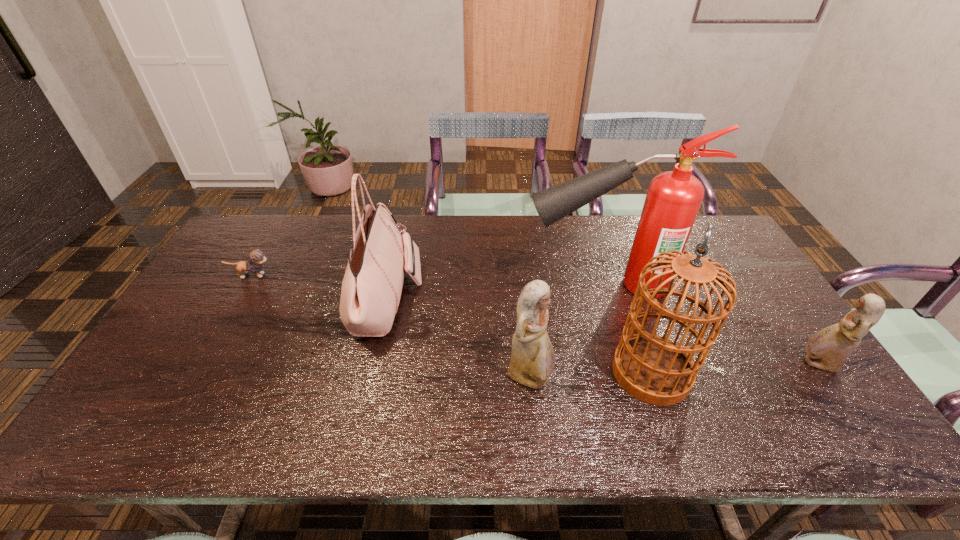
Locate an element on the screen. The image size is (960, 540). vacant space in between the handbag and the second shortest object is located at coordinates (602, 332).

I want to click on free space between the birdcage and the leftmost object, so click(x=451, y=324).

Find the location of a particular element. This screenshot has width=960, height=540. vacant area that lies between the fourth tallest object and the fire extinguisher is located at coordinates (567, 332).

Find the location of `unoccupied position between the fire extinguisher and the kitten`. unoccupied position between the fire extinguisher and the kitten is located at coordinates (427, 280).

Find the location of a particular element. object that can be found as the second closest to the birdcage is located at coordinates (673, 199).

Find the location of a particular element. object that stands as the third closest to the second shortest object is located at coordinates (532, 362).

You are a GUI agent. You are given a task and a screenshot of the screen. Output one action in this format:
    pyautogui.click(x=<x>, y=<y>)
    Task: Click on the free spot that satisfies the following two spatial constraints: 1. on the side of the fifth object from right to left with the attached pouch; 2. on the back side of the birdcage
    
    Given the screenshot: What is the action you would take?
    pyautogui.click(x=372, y=372)

At what (x,y) coordinates should I click in order to perform the action: click on free space that satisfies the following two spatial constraints: 1. at the nozzle of the fire extinguisher; 2. on the left side of the birdcage. Please return your answer as a coordinate pair (x, y). Image resolution: width=960 pixels, height=540 pixels. Looking at the image, I should click on (630, 372).